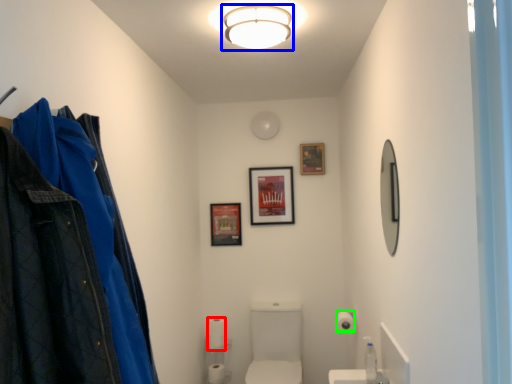
Question: Considering the real-world distances, which object is closest to toilet paper (highlighted by a red box)? fixture (highlighted by a blue box) or toilet paper (highlighted by a green box).

Choices:
 (A) fixture
 (B) toilet paper

Answer: (B)